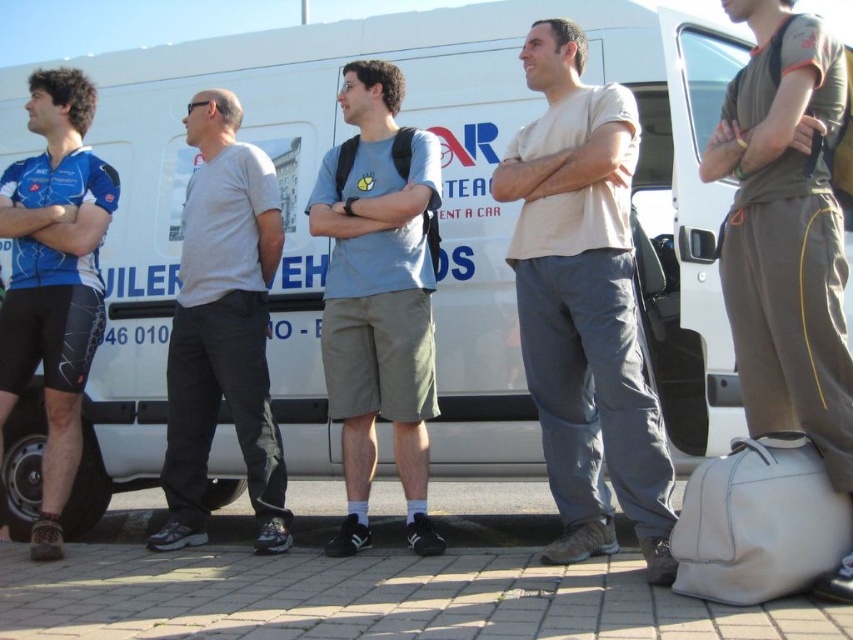
You are standing in front of the white van with the group. You need to find the matte gray pants at right. Where exactly should you look relative to the van?

The matte gray pants at right are located at point 0.362 along the horizontal axis and 0.923 along the vertical axis relative to the van.

You are standing in front of the van and see the matte gray pants at right and the blue jersey at left. Which one is positioned to the right of the other?

The matte gray pants at right are positioned to the right of the blue jersey at left.